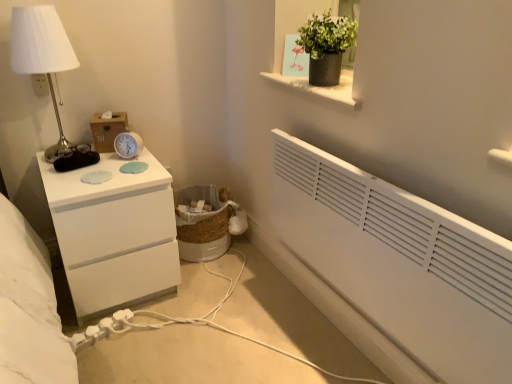
Image resolution: width=512 pixels, height=384 pixels. I want to click on vacant space underneath matte black pot at upper center (from a real-world perspective), so click(321, 88).